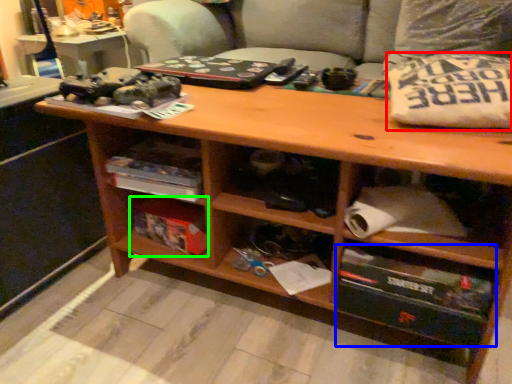
Question: Which is farther away from pillow (highlighted by a red box)? drawer (highlighted by a blue box) or box (highlighted by a green box)?

Choices:
 (A) drawer
 (B) box

Answer: (B)